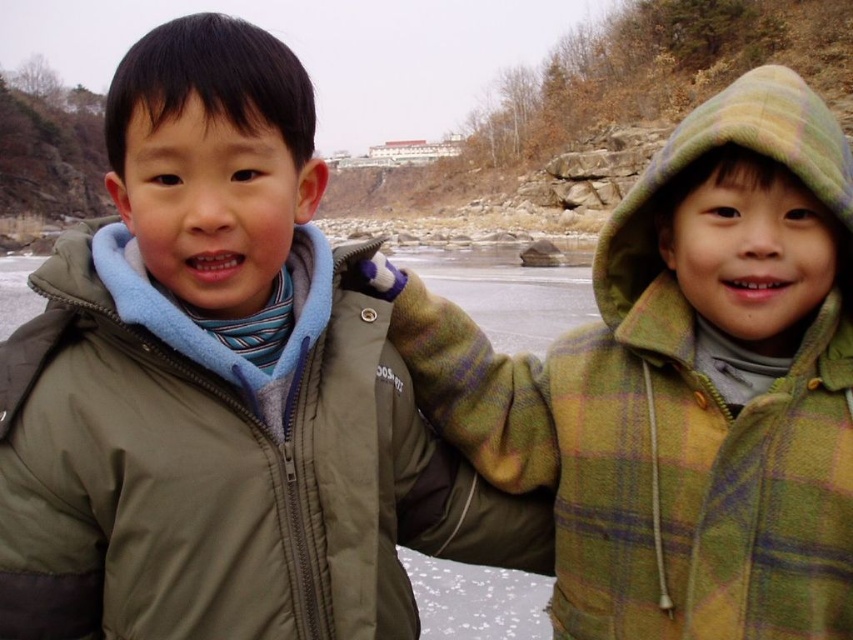
Question: Is green plaid jacket at right in front of olive green puffer jacket at left?

Choices:
 (A) no
 (B) yes

Answer: (A)

Question: Which of the following is the closest to the observer?

Choices:
 (A) green plaid hood at upper right
 (B) olive green puffer jacket at left
 (C) green plaid jacket at right

Answer: (B)

Question: Does green plaid jacket at right have a greater width compared to green plaid hood at upper right?

Choices:
 (A) no
 (B) yes

Answer: (A)

Question: Is green plaid jacket at right bigger than olive green puffer jacket at left?

Choices:
 (A) yes
 (B) no

Answer: (A)

Question: Which of the following is the farthest from the observer?

Choices:
 (A) green plaid jacket at right
 (B) olive green puffer jacket at left

Answer: (A)

Question: Among these objects, which one is farthest from the camera?

Choices:
 (A) olive green puffer jacket at left
 (B) green plaid jacket at right
 (C) green plaid hood at upper right

Answer: (C)